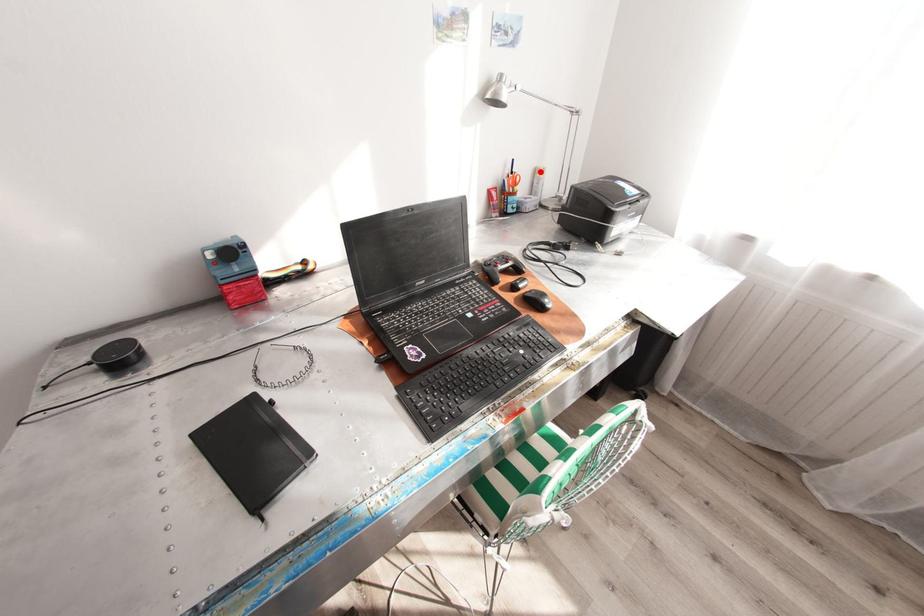
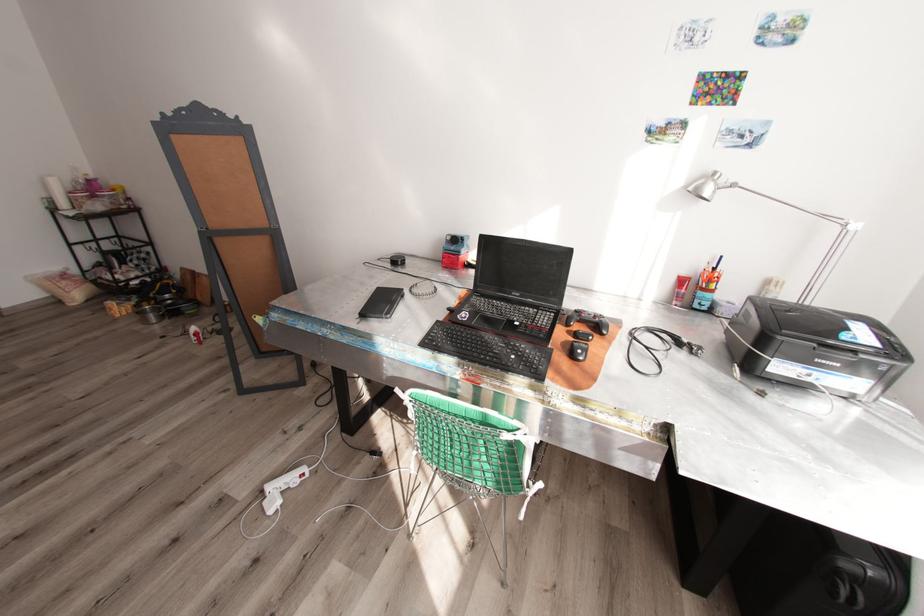
Question: I am providing you with two images of the same scene from different viewpoints. A red point is shown in image1. For the corresponding object point in image2, is it positioned nearer or farther from the camera?

Choices:
 (A) Nearer
 (B) Farther

Answer: (B)